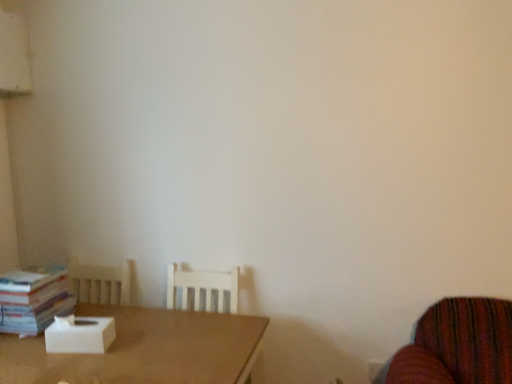
Question: Is white cardboard box at center taller than brown matte table at lower left?

Choices:
 (A) yes
 (B) no

Answer: (B)

Question: Can you confirm if white cardboard box at center is thinner than brown matte table at lower left?

Choices:
 (A) yes
 (B) no

Answer: (A)

Question: Is white cardboard box at center outside brown matte table at lower left?

Choices:
 (A) no
 (B) yes

Answer: (B)

Question: Can you confirm if white cardboard box at center is wider than brown matte table at lower left?

Choices:
 (A) yes
 (B) no

Answer: (B)

Question: From the image's perspective, would you say white cardboard box at center is positioned over brown matte table at lower left?

Choices:
 (A) no
 (B) yes

Answer: (B)

Question: From a real-world perspective, is white cardboard box at center above or below white paper book at left?

Choices:
 (A) below
 (B) above

Answer: (A)

Question: In the image, is white cardboard box at center positioned in front of or behind white paper book at left?

Choices:
 (A) front
 (B) behind

Answer: (A)

Question: Is point (91, 322) closer or farther from the camera than point (18, 316)?

Choices:
 (A) closer
 (B) farther

Answer: (A)

Question: In terms of size, does white cardboard box at center appear bigger or smaller than white paper book at left?

Choices:
 (A) big
 (B) small

Answer: (B)

Question: From a real-world perspective, is white paper book at left above or below brown matte table at lower left?

Choices:
 (A) above
 (B) below

Answer: (A)

Question: In terms of height, does white paper book at left look taller or shorter compared to brown matte table at lower left?

Choices:
 (A) tall
 (B) short

Answer: (B)

Question: In the image, is white paper book at left on the left side or the right side of brown matte table at lower left?

Choices:
 (A) left
 (B) right

Answer: (A)

Question: From the image's perspective, is white paper book at left located above or below brown matte table at lower left?

Choices:
 (A) above
 (B) below

Answer: (A)

Question: Considering the positions of brown matte table at lower left and white cardboard box at center in the image, is brown matte table at lower left bigger or smaller than white cardboard box at center?

Choices:
 (A) big
 (B) small

Answer: (A)

Question: Is brown matte table at lower left taller or shorter than white cardboard box at center?

Choices:
 (A) short
 (B) tall

Answer: (B)